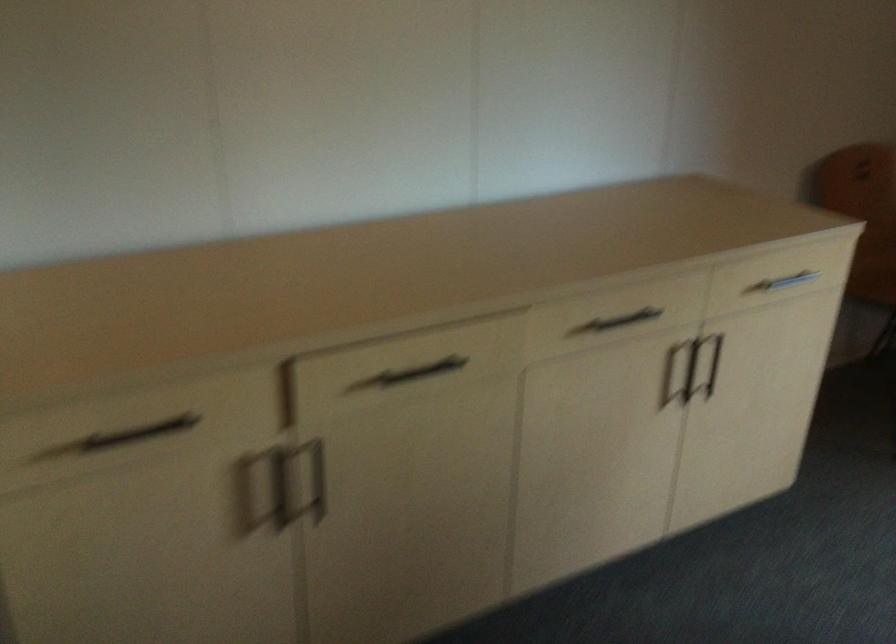
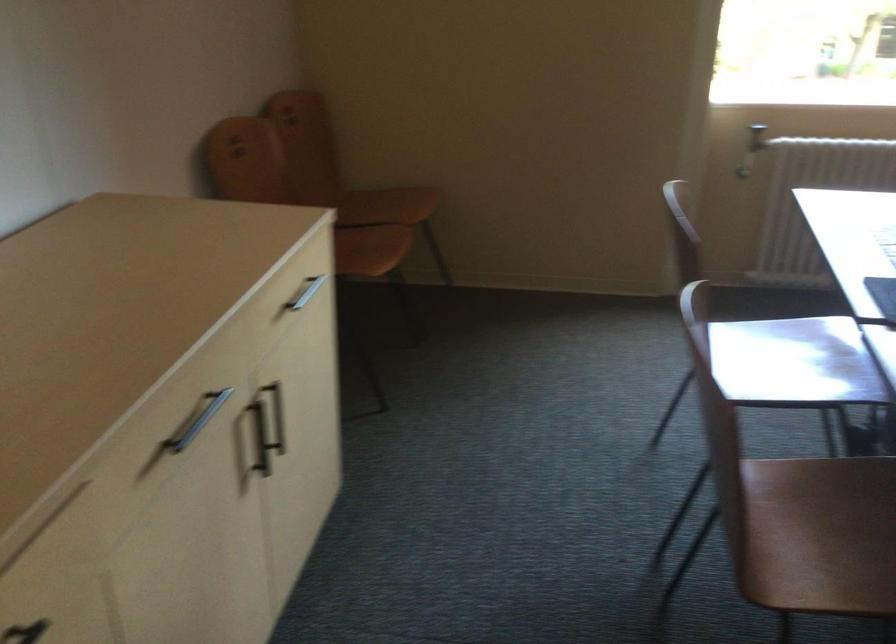
Find the pixel in the second image that matches point (629, 327) in the first image.

(197, 420)